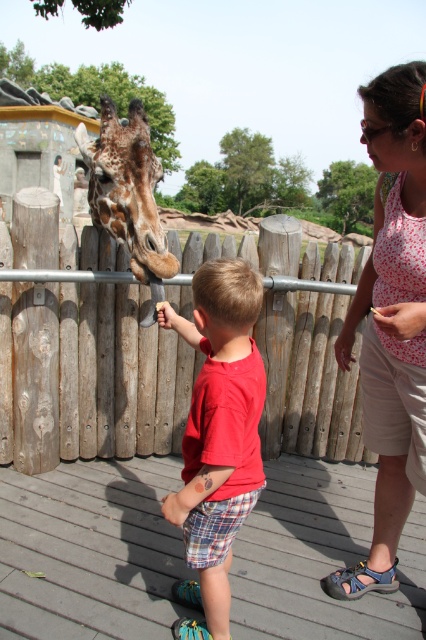
The wooden fence at center is located at point [80,349]. If you want to place a new bench 0.3 units to the right of the wooden fence at center, what would be the new coordinate for the bench?

The new coordinate for the bench would be calculated by adding 0.3 to the x value of the wooden fence at center. The original x coordinate is 0.547. Adding 0.3 gives 0.547 0.3 0.847. The y coordinate remains 0.190. Therefore, the new coordinate is 0.847, 0.190.

Based on the scene description, can you determine which object is taller between the red cotton shirt at center and the brown spotted fur at center?

The red cotton shirt at center is taller than the brown spotted fur at center according to the description.